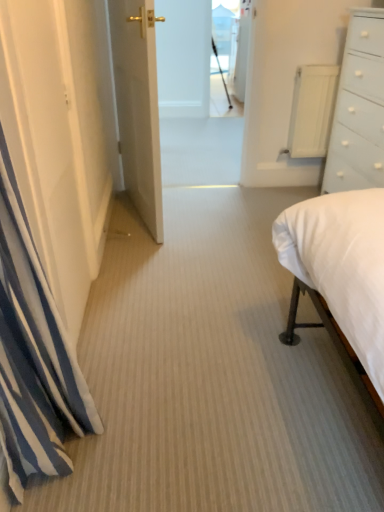
Question: Considering the relative positions of white striped curtain at left and white painted wood chest of drawers at right in the image provided, is white striped curtain at left behind white painted wood chest of drawers at right?

Choices:
 (A) yes
 (B) no

Answer: (B)

Question: Does white striped curtain at left lie in front of white painted wood chest of drawers at right?

Choices:
 (A) no
 (B) yes

Answer: (B)

Question: From the image's perspective, is white striped curtain at left above white painted wood chest of drawers at right?

Choices:
 (A) yes
 (B) no

Answer: (B)

Question: Would you say white painted wood chest of drawers at right is part of white striped curtain at left's contents?

Choices:
 (A) no
 (B) yes

Answer: (A)

Question: Considering the relative sizes of white striped curtain at left and white painted wood chest of drawers at right in the image provided, is white striped curtain at left bigger than white painted wood chest of drawers at right?

Choices:
 (A) no
 (B) yes

Answer: (A)

Question: From the image's perspective, is white striped curtain at left beneath white painted wood chest of drawers at right?

Choices:
 (A) yes
 (B) no

Answer: (A)

Question: Does transparent glass door at upper center have a greater height compared to white glossy door at center?

Choices:
 (A) no
 (B) yes

Answer: (A)

Question: Is transparent glass door at upper center not near white glossy door at center?

Choices:
 (A) no
 (B) yes

Answer: (B)

Question: Does transparent glass door at upper center contain white glossy door at center?

Choices:
 (A) no
 (B) yes

Answer: (A)

Question: From the image's perspective, is transparent glass door at upper center located beneath white glossy door at center?

Choices:
 (A) no
 (B) yes

Answer: (A)

Question: Is transparent glass door at upper center next to white glossy door at center and touching it?

Choices:
 (A) yes
 (B) no

Answer: (B)

Question: Considering the relative positions of transparent glass door at upper center and white glossy door at center in the image provided, is transparent glass door at upper center in front of white glossy door at center?

Choices:
 (A) no
 (B) yes

Answer: (A)

Question: From a real-world perspective, is white painted wood chest of drawers at right below white striped curtain at left?

Choices:
 (A) no
 (B) yes

Answer: (B)